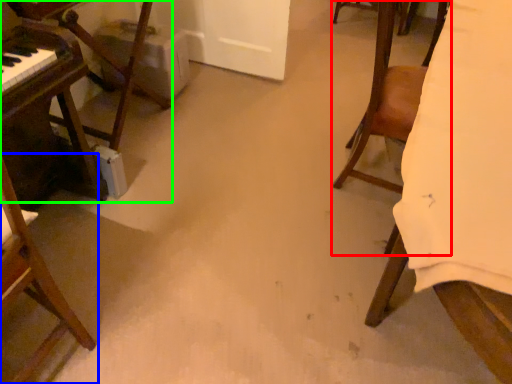
Question: Based on their relative distances, which object is farther from chair (highlighted by a red box)? Choose from chair (highlighted by a blue box) and furniture (highlighted by a green box).

Choices:
 (A) chair
 (B) furniture

Answer: (A)